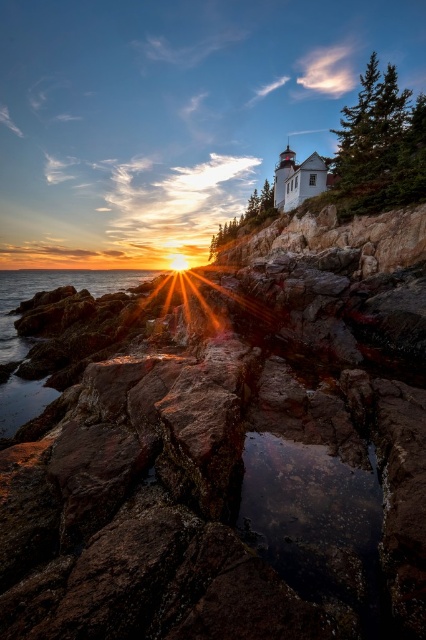
Question: Can you confirm if rusty stone rocks at center is positioned below translucent wet rocks at lower left?

Choices:
 (A) no
 (B) yes

Answer: (B)

Question: Which of the following is the farthest from the observer?

Choices:
 (A) (97, 272)
 (B) (163, 588)

Answer: (A)

Question: Is rusty stone rocks at center smaller than translucent wet rocks at lower left?

Choices:
 (A) yes
 (B) no

Answer: (A)

Question: Which of the following is the farthest from the observer?

Choices:
 (A) rusty stone rocks at center
 (B) translucent wet rocks at lower left

Answer: (B)

Question: Can you confirm if rusty stone rocks at center is smaller than translucent wet rocks at lower left?

Choices:
 (A) no
 (B) yes

Answer: (B)